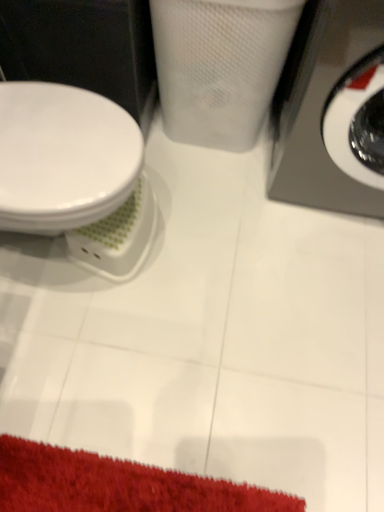
Question: Can you confirm if white glossy toilet at left is smaller than metallic gray washing machine at right?

Choices:
 (A) yes
 (B) no

Answer: (A)

Question: Is white glossy toilet at left wider than metallic gray washing machine at right?

Choices:
 (A) no
 (B) yes

Answer: (A)

Question: From a real-world perspective, is white glossy toilet at left located higher than metallic gray washing machine at right?

Choices:
 (A) yes
 (B) no

Answer: (B)

Question: Is white glossy toilet at left located outside metallic gray washing machine at right?

Choices:
 (A) yes
 (B) no

Answer: (A)

Question: Is white glossy toilet at left positioned behind metallic gray washing machine at right?

Choices:
 (A) no
 (B) yes

Answer: (B)

Question: Can you confirm if white glossy toilet at left is thinner than metallic gray washing machine at right?

Choices:
 (A) no
 (B) yes

Answer: (B)

Question: Does metallic gray washing machine at right have a lesser height compared to white glossy toilet at left?

Choices:
 (A) no
 (B) yes

Answer: (A)

Question: Is metallic gray washing machine at right smaller than white glossy toilet at left?

Choices:
 (A) yes
 (B) no

Answer: (B)

Question: Is metallic gray washing machine at right thinner than white glossy toilet at left?

Choices:
 (A) no
 (B) yes

Answer: (A)

Question: Is white glossy toilet at left at the back of metallic gray washing machine at right?

Choices:
 (A) yes
 (B) no

Answer: (B)

Question: From a real-world perspective, does metallic gray washing machine at right stand above white glossy toilet at left?

Choices:
 (A) no
 (B) yes

Answer: (B)

Question: Does metallic gray washing machine at right have a greater width compared to white glossy toilet at left?

Choices:
 (A) no
 (B) yes

Answer: (B)

Question: Is white glossy toilet at left in front of or behind metallic gray washing machine at right in the image?

Choices:
 (A) front
 (B) behind

Answer: (B)